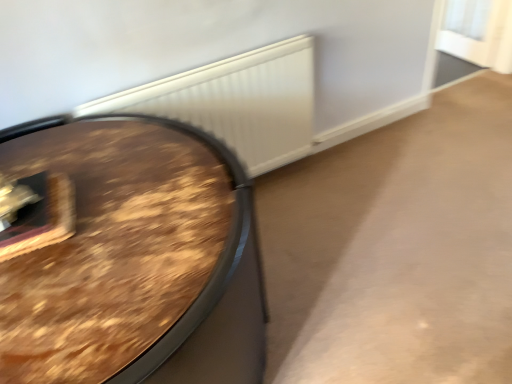
This screenshot has width=512, height=384. What are the coordinates of `white textured radiator at center` in the screenshot? It's located at [x=237, y=102].

Describe the element at coordinates (237, 102) in the screenshot. This screenshot has width=512, height=384. I see `white textured radiator at center` at that location.

Identify the location of white textured radiator at center. (237, 102).